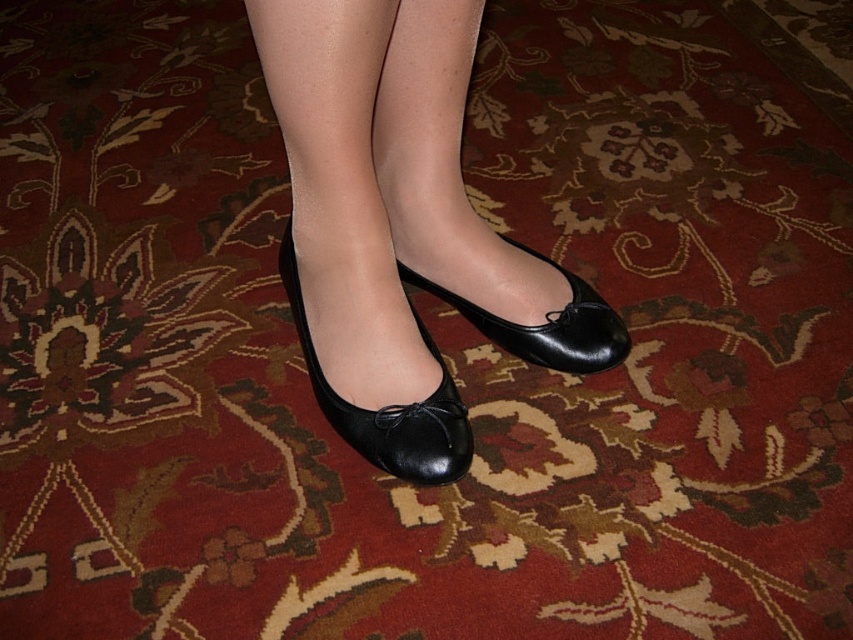
You are a photographer trying to capture the details of both the black leather shoes at center and the black leather shoe at center. Since they are positioned differently, which one should you focus on first to ensure the closest subject is sharp?

The black leather shoes at center is closer to the viewer than the black leather shoe at center, so you should focus on the black leather shoes at center first to ensure the closest subject is sharp.

Looking at this image, you are a photographer setting up a shoot in a room with a deep red carpet. You notice two objects in the scene described as black leather shoes at center and black leather shoe at center. Which one is positioned higher up?

The black leather shoes at center is positioned higher up than the black leather shoe at center.